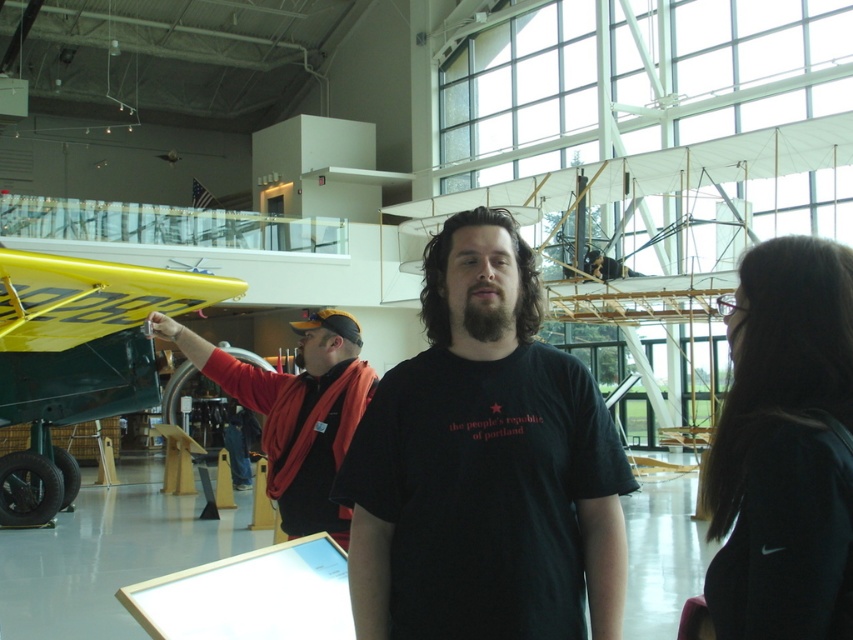
Is black fabric at center below orange fabric jacket at center?

No.

Does black fabric at center have a larger size compared to orange fabric jacket at center?

No.

Between point (752, 531) and point (283, 410), which one is positioned in front?

Point (752, 531) is in front.

Where is `black fabric at center`? Image resolution: width=853 pixels, height=640 pixels. black fabric at center is located at coordinates (784, 449).

Between black matte t-shirt at center and orange fabric jacket at center, which one has more height?

black matte t-shirt at center

Which is behind, point (494, 417) or point (339, 433)?

The point (339, 433) is more distant.

Locate an element on the screen. The image size is (853, 640). black matte t-shirt at center is located at coordinates (485, 465).

Which of these two, black matte t-shirt at center or yellow matte airplane at left, stands shorter?

With less height is black matte t-shirt at center.

Is point (505, 428) farther from camera compared to point (0, 397)?

No.

Between point (467, 417) and point (51, 410), which one is positioned behind?

The point (51, 410) is more distant.

Identify the location of black matte t-shirt at center. (485, 465).